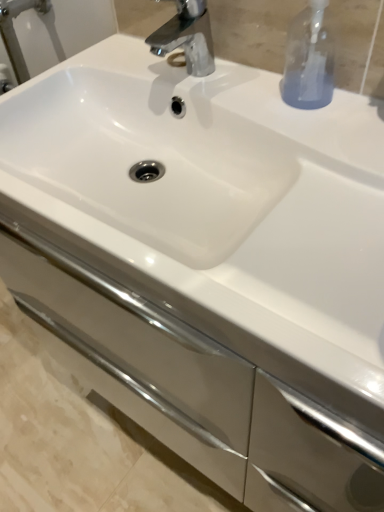
Where is `free space to the back side of polished chrome faucet at upper center`? The height and width of the screenshot is (512, 384). free space to the back side of polished chrome faucet at upper center is located at coordinates (139, 55).